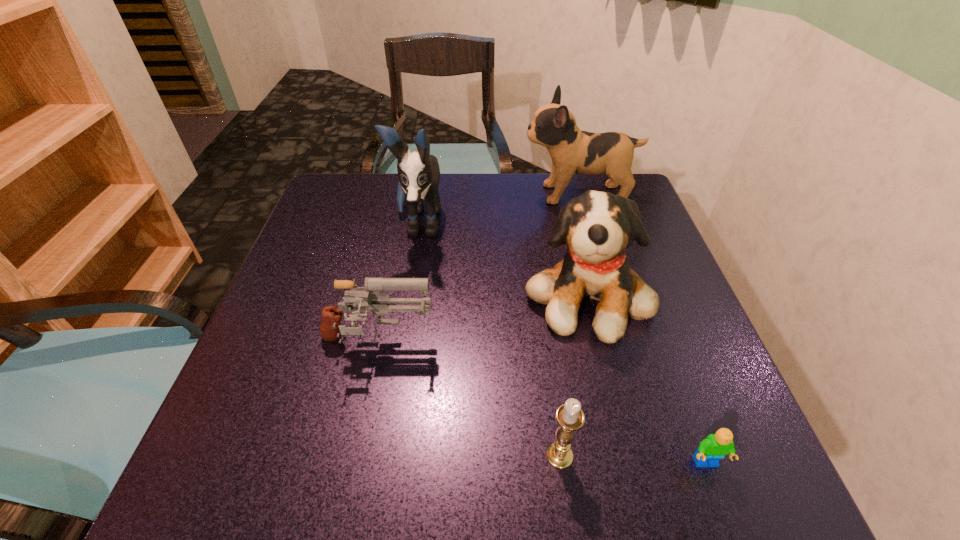
Locate an element on the screen. This screenshot has height=540, width=960. free space in the image that satisfies the following two spatial constraints: 1. at the face of the shortest puppy; 2. at the barrel end of the gun is located at coordinates (600, 343).

In order to click on vacant space that satisfies the following two spatial constraints: 1. at the barrel end of the gun; 2. on the right side of the candle holder in this screenshot , I will do `click(353, 456)`.

Locate an element on the screen. The width and height of the screenshot is (960, 540). vacant space that satisfies the following two spatial constraints: 1. at the barrel end of the gun; 2. on the left side of the candle holder is located at coordinates (353, 456).

The image size is (960, 540). I want to click on blank area in the image that satisfies the following two spatial constraints: 1. on the back side of the candle holder; 2. at the barrel end of the gun, so click(x=545, y=343).